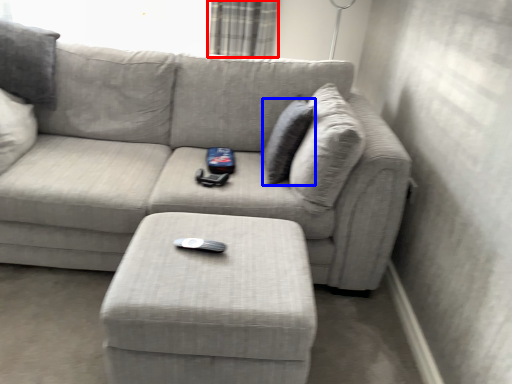
Question: Which point is further to the camera, curtain (highlighted by a red box) or pillow (highlighted by a blue box)?

Choices:
 (A) curtain
 (B) pillow

Answer: (A)